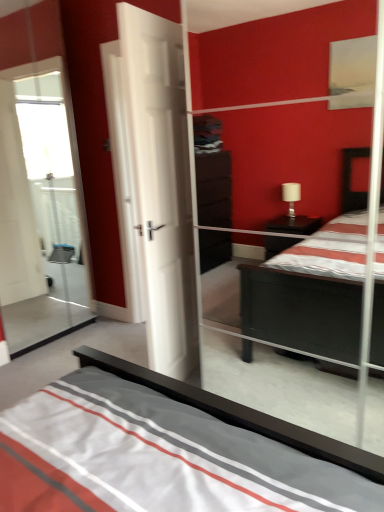
Question: Is transparent glass door at left to the left or to the right of white matte door at center in the image?

Choices:
 (A) left
 (B) right

Answer: (A)

Question: Relative to white matte door at center, is transparent glass door at left in front or behind?

Choices:
 (A) front
 (B) behind

Answer: (B)

Question: From a real-world perspective, relative to white matte door at center, is transparent glass door at left vertically above or below?

Choices:
 (A) below
 (B) above

Answer: (B)

Question: From their relative heights in the image, would you say white matte door at center is taller or shorter than transparent glass door at left?

Choices:
 (A) short
 (B) tall

Answer: (A)

Question: Is point (167, 83) positioned closer to the camera than point (51, 315)?

Choices:
 (A) closer
 (B) farther

Answer: (A)

Question: Is white matte door at center inside or outside of transparent glass door at left?

Choices:
 (A) outside
 (B) inside

Answer: (A)

Question: From a real-world perspective, is white matte door at center positioned above or below transparent glass door at left?

Choices:
 (A) below
 (B) above

Answer: (A)